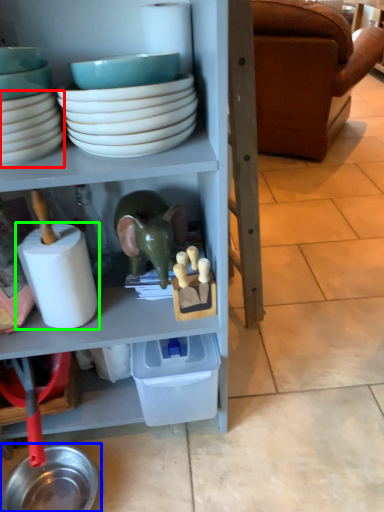
Question: Based on their relative distances, which object is nearer to bowl (highlighted by a red box)? Choose from tableware (highlighted by a blue box) and toilet paper (highlighted by a green box).

Choices:
 (A) tableware
 (B) toilet paper

Answer: (B)